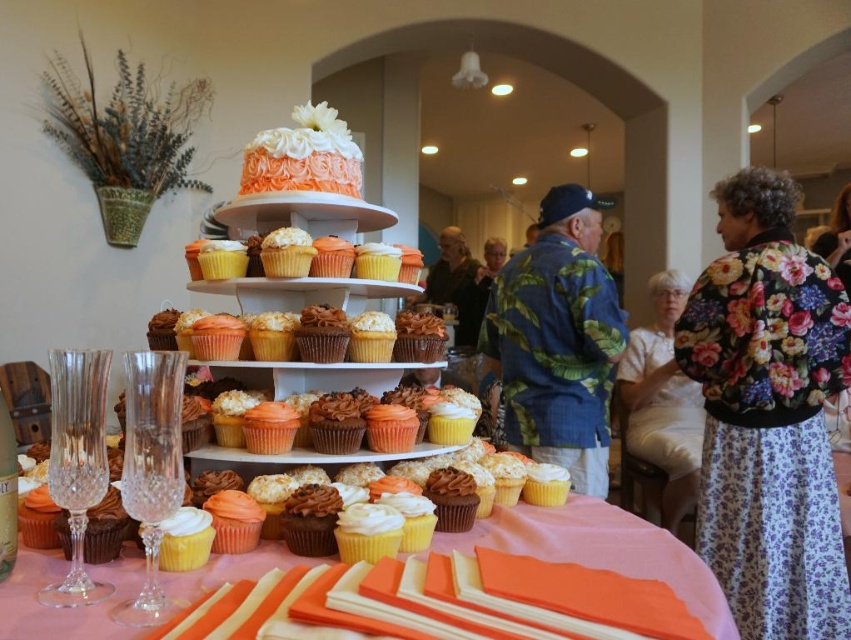
In the scene shown: Can you confirm if matte orange cake at center is positioned to the left of yellow frosted cupcake at center?

Yes, matte orange cake at center is to the left of yellow frosted cupcake at center.

Looking at this image, how distant is matte orange cake at center from yellow frosted cupcake at center?

matte orange cake at center and yellow frosted cupcake at center are 24.98 inches apart from each other.

Locate an element on the screen. Image resolution: width=851 pixels, height=640 pixels. matte orange cake at center is located at coordinates (304, 156).

Identify the location of matte orange cake at center. (304, 156).

Which is more to the left, orange matte napkins at lower center or orange frosting cupcake at center?

orange frosting cupcake at center

Locate an element on the screen. orange matte napkins at lower center is located at coordinates (603, 548).

Can you confirm if matte orange cake at center is positioned above dark brown leather jacket at center?

Correct, matte orange cake at center is located above dark brown leather jacket at center.

Does matte orange cake at center appear on the right side of dark brown leather jacket at center?

No, matte orange cake at center is not to the right of dark brown leather jacket at center.

Between point (253, 182) and point (426, 288), which one is positioned behind?

The point (426, 288) is behind.

Identify the location of matte orange cake at center. (304, 156).